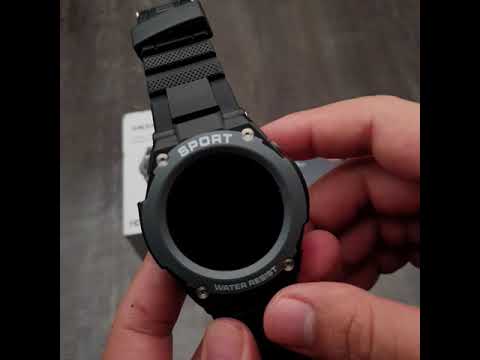
Identify the location of floor. (317, 73).